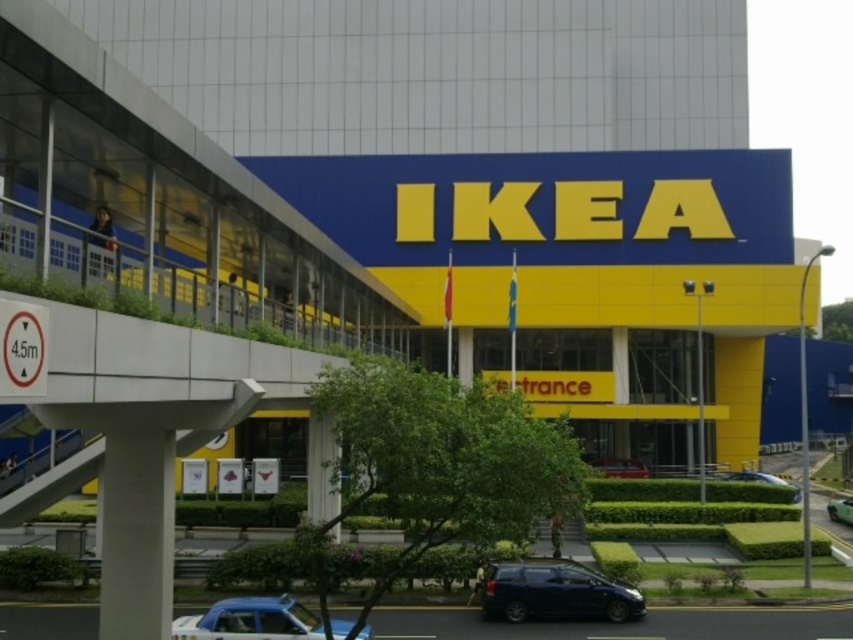
The image size is (853, 640). What do you see at coordinates (619, 467) in the screenshot? I see `metallic blue sedan at center` at bounding box center [619, 467].

Between point (640, 472) and point (837, 508), which one is positioned in front?

Point (837, 508) is more forward.

Identify the location of metallic blue sedan at center. Image resolution: width=853 pixels, height=640 pixels. (619, 467).

Measure the distance from shiny dark blue minivan at lower center to metallic silver car at center.

shiny dark blue minivan at lower center is 20.85 meters from metallic silver car at center.

From the picture: Between shiny dark blue minivan at lower center and metallic silver car at center, which one is positioned higher?

Positioned higher is shiny dark blue minivan at lower center.

Is point (590, 604) positioned in front of point (747, 477)?

Yes, point (590, 604) is closer to viewer.

This screenshot has height=640, width=853. I want to click on shiny dark blue minivan at lower center, so click(556, 593).

Can you confirm if shiny dark blue minivan at lower center is thinner than metallic blue sedan at center?

Incorrect, shiny dark blue minivan at lower center's width is not less than metallic blue sedan at center's.

The image size is (853, 640). Describe the element at coordinates (556, 593) in the screenshot. I see `shiny dark blue minivan at lower center` at that location.

You are a GUI agent. You are given a task and a screenshot of the screen. Output one action in this format:
    pyautogui.click(x=<x>, y=<y>)
    Task: Click on the shiny dark blue minivan at lower center
    This screenshot has height=640, width=853.
    Given the screenshot: What is the action you would take?
    tap(556, 593)